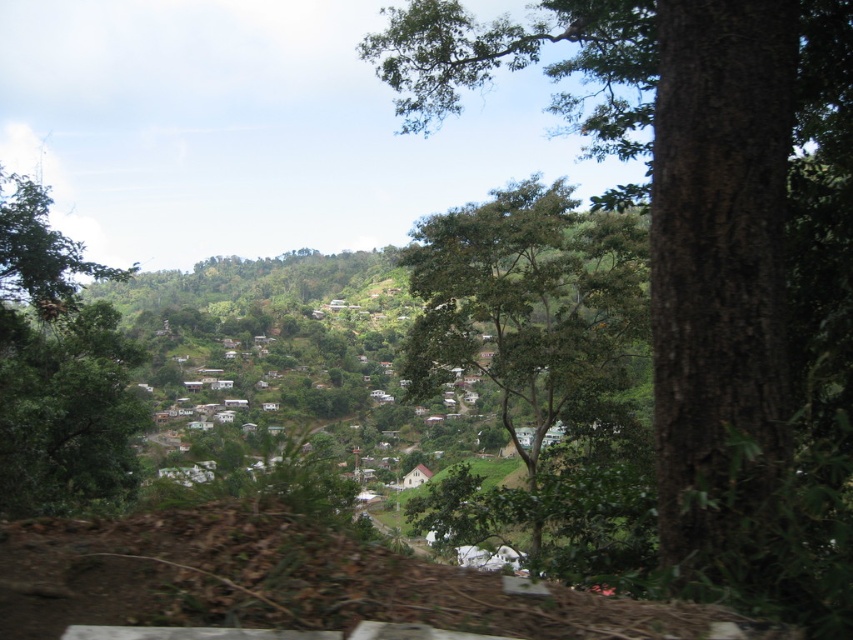
Locate an element on the screen. The image size is (853, 640). green rough bark tree at center is located at coordinates (711, 256).

Can you confirm if green rough bark tree at center is bigger than green leafy tree at center?

Correct, green rough bark tree at center is larger in size than green leafy tree at center.

Who is more distant from viewer, [720,580] or [631,232]?

Positioned behind is point [631,232].

At what (x,y) coordinates should I click in order to perform the action: click on green rough bark tree at center. Please return your answer as a coordinate pair (x, y). This screenshot has width=853, height=640. Looking at the image, I should click on (711, 256).

What do you see at coordinates (711, 256) in the screenshot? I see `green rough bark tree at center` at bounding box center [711, 256].

Can you confirm if green rough bark tree at center is positioned above green leafy tree at left?

Correct, green rough bark tree at center is located above green leafy tree at left.

Who is more distant from viewer, (814, 248) or (123, 384)?

The point (123, 384) is behind.

The image size is (853, 640). Find the location of `green rough bark tree at center`. green rough bark tree at center is located at coordinates (711, 256).

Does green leafy tree at center have a greater width compared to green leafy tree at left?

No, green leafy tree at center is not wider than green leafy tree at left.

Does green leafy tree at center appear on the left side of green leafy tree at left?

No, green leafy tree at center is not to the left of green leafy tree at left.

You are a GUI agent. You are given a task and a screenshot of the screen. Output one action in this format:
    pyautogui.click(x=<x>, y=<y>)
    Task: Click on the green leafy tree at center
    The width and height of the screenshot is (853, 640).
    Given the screenshot: What is the action you would take?
    pyautogui.click(x=537, y=342)